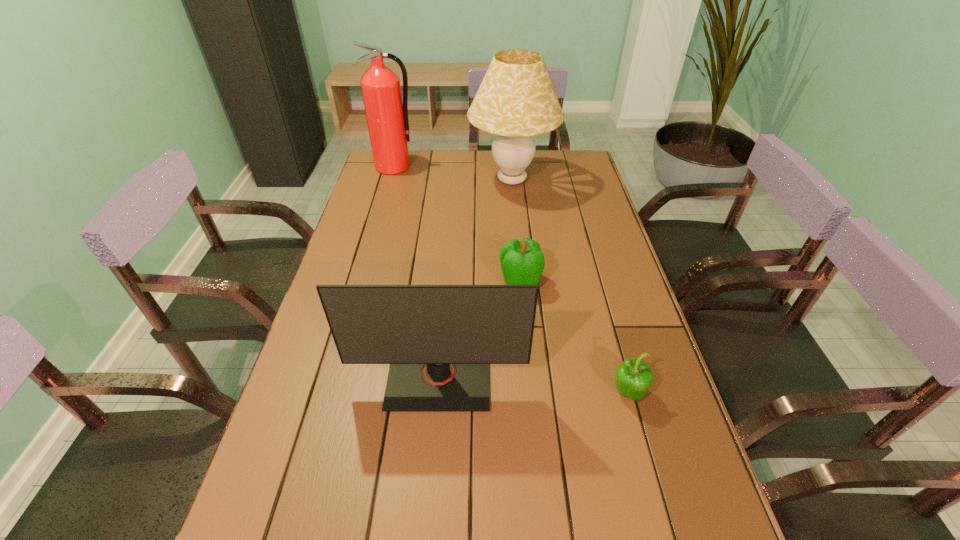
Where is `free space at the far edge of the desktop`? free space at the far edge of the desktop is located at coordinates click(x=541, y=151).

In the image, there is a desktop. Where is `free space at the left edge`? The width and height of the screenshot is (960, 540). free space at the left edge is located at coordinates (372, 233).

Where is `free space at the right edge of the desktop`? The height and width of the screenshot is (540, 960). free space at the right edge of the desktop is located at coordinates (592, 277).

In the image, there is a desktop. At what (x,y) coordinates should I click in order to perform the action: click on vacant region at the far right corner. Please return your answer as a coordinate pair (x, y). Looking at the image, I should click on (576, 165).

Locate an element on the screen. Image resolution: width=960 pixels, height=540 pixels. free spot between the monitor and the lampshade is located at coordinates (475, 281).

Image resolution: width=960 pixels, height=540 pixels. Identify the location of free space that is in between the rightmost object and the third tallest object. (533, 387).

You are a GUI agent. You are given a task and a screenshot of the screen. Output one action in this format:
    pyautogui.click(x=<x>, y=<y>)
    Task: Click on the vacant area that lies between the left bell pepper and the right bell pepper
    The width and height of the screenshot is (960, 540).
    Given the screenshot: What is the action you would take?
    pyautogui.click(x=573, y=338)

The image size is (960, 540). What are the coordinates of `vacant space in between the lampshade and the rightmost object` in the screenshot? It's located at (569, 287).

Locate an element on the screen. The image size is (960, 540). unoccupied area between the fire extinguisher and the third farthest object is located at coordinates (457, 224).

What are the coordinates of `vacant space in between the fire extinguisher and the farther bell pepper` in the screenshot? It's located at (457, 224).